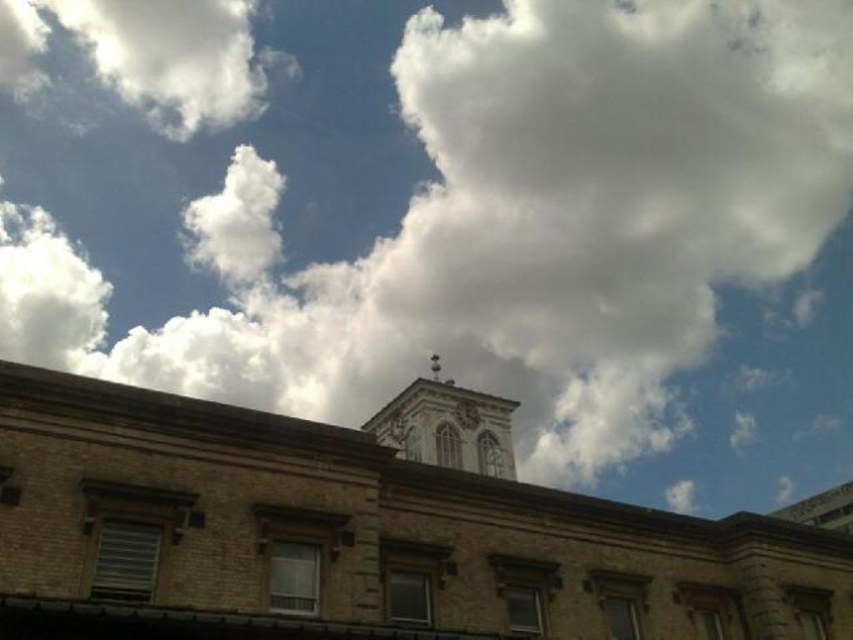
You are standing in front of the building and want to know if the brown brick church at center can fit entirely within the space occupied by the smooth stone bell tower at center. Based on their widths, what is your conclusion?

The brown brick church at center might be wider than smooth stone bell tower at center, so it may not fit entirely within the space occupied by the bell tower.

You are standing at the center of the image. Which direction should you move to get closer to the brown brick church at center?

Since the brown brick church at center is already at the center of the image, you don not need to move in any direction to get closer to it.